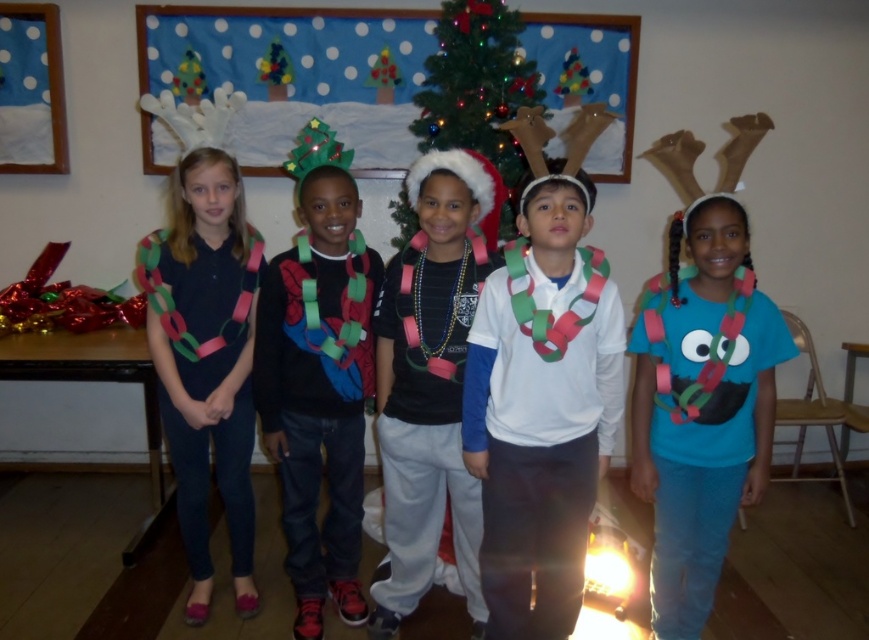
You are a photographer taking a photo of the matte black shirt at center and the green paper chain at center. Which object will appear bigger in the photo?

The matte black shirt at center is larger in size than the green paper chain at center, so it will appear bigger in the photo.

You are a photographer taking a picture of the matte black shirt at center and the green paper chain at center. Based on their positions, which object should you focus on first to ensure both are in frame?

The matte black shirt at center is below the green paper chain at center, so you should focus on the green paper chain at center first to ensure both are in frame.

You are a photographer setting up for a group photo. You notice the matte black shirt at center and the green paper chain at center. Which object should you focus on first if you want to capture the taller one?

The matte black shirt at center is taller than the green paper chain at center, so you should focus on the matte black shirt at center first.